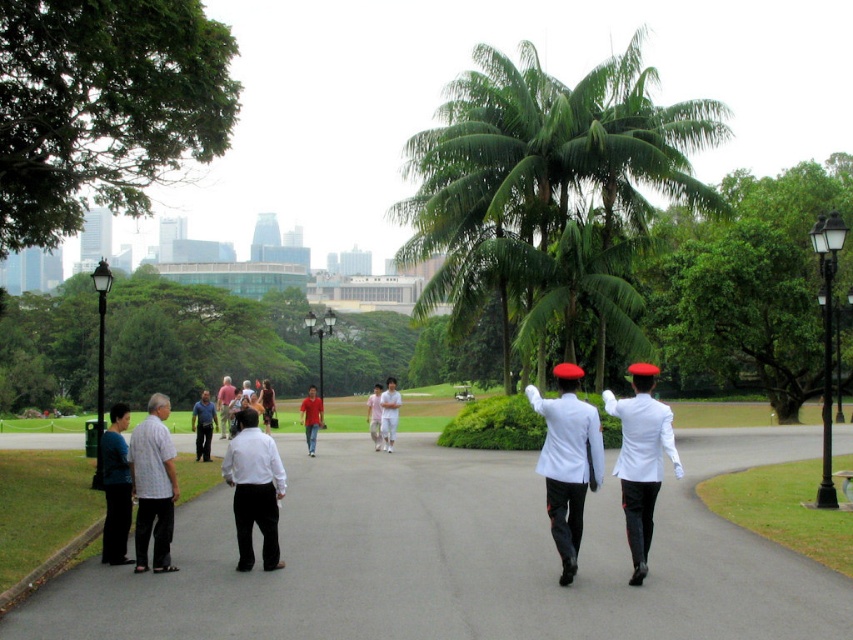
You are a park maintenance worker who needs to mow the lawn between the gray asphalt pavement at center and the green leafy palm tree at center. Which area has a wider space for you to work in?

The gray asphalt pavement at center has a larger width than the green leafy palm tree at center, so you should mow the area around the gray asphalt pavement at center first since it offers more space to work in.

You are a photographer positioned at the park entrance. You notice two people wearing white matte clothing at the center of the image. Which one is taller between the white matte uniform at center and the white matte shirt at center?

The white matte uniform at center is taller than the white matte shirt at center.